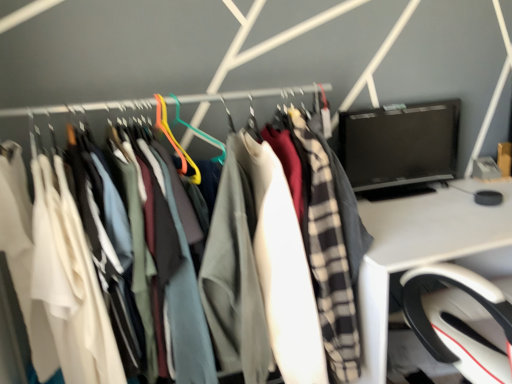
Question: Looking at the image, does matte fabric clothes at left seem bigger or smaller compared to black glossy monitor at upper right?

Choices:
 (A) small
 (B) big

Answer: (B)

Question: Is matte fabric clothes at left spatially inside black glossy monitor at upper right, or outside of it?

Choices:
 (A) outside
 (B) inside

Answer: (A)

Question: Which is nearer to the matte fabric clothes at left?

Choices:
 (A) white glossy desk at right
 (B) black glossy monitor at upper right

Answer: (A)

Question: Estimate the real-world distances between objects in this image. Which object is farther from the black glossy monitor at upper right?

Choices:
 (A) matte fabric clothes at left
 (B) white glossy desk at right

Answer: (A)